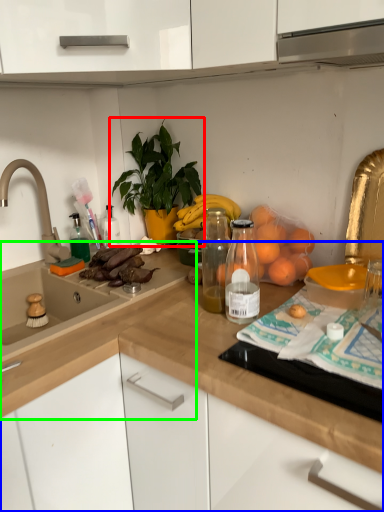
Question: Which is farther away from houseplant (highlighted by a red box)? countertop (highlighted by a blue box) or countertop (highlighted by a green box)?

Choices:
 (A) countertop
 (B) countertop

Answer: (A)